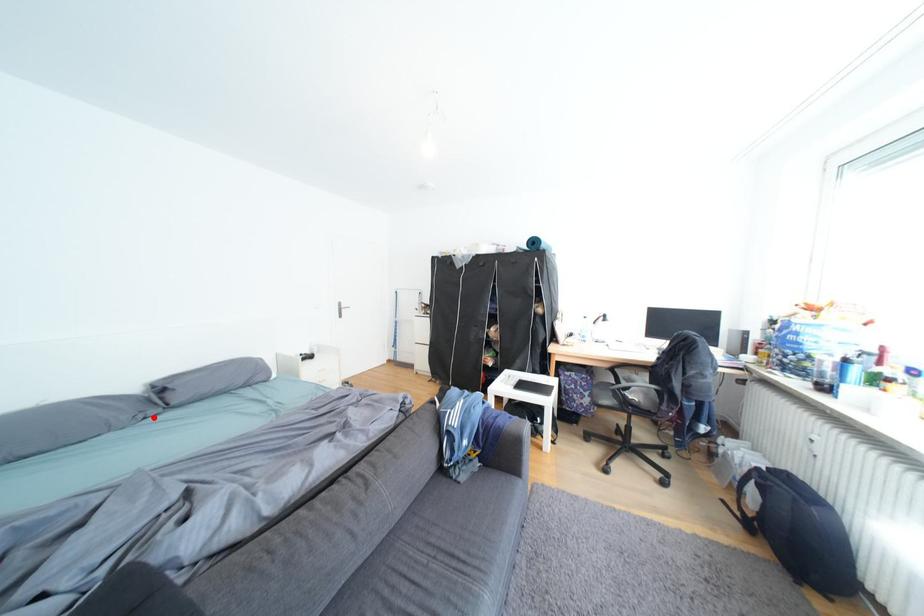
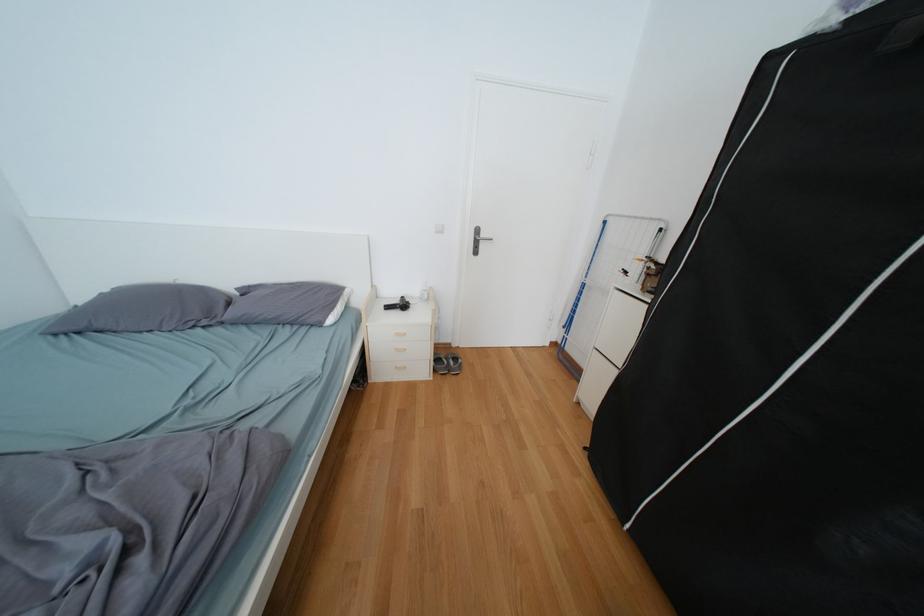
Question: I am providing you with two images of the same scene from different viewpoints. A red point is marked on the first image. At the location where the point appears in image 1, is it still visible in image 2?

Choices:
 (A) Yes
 (B) No

Answer: (A)